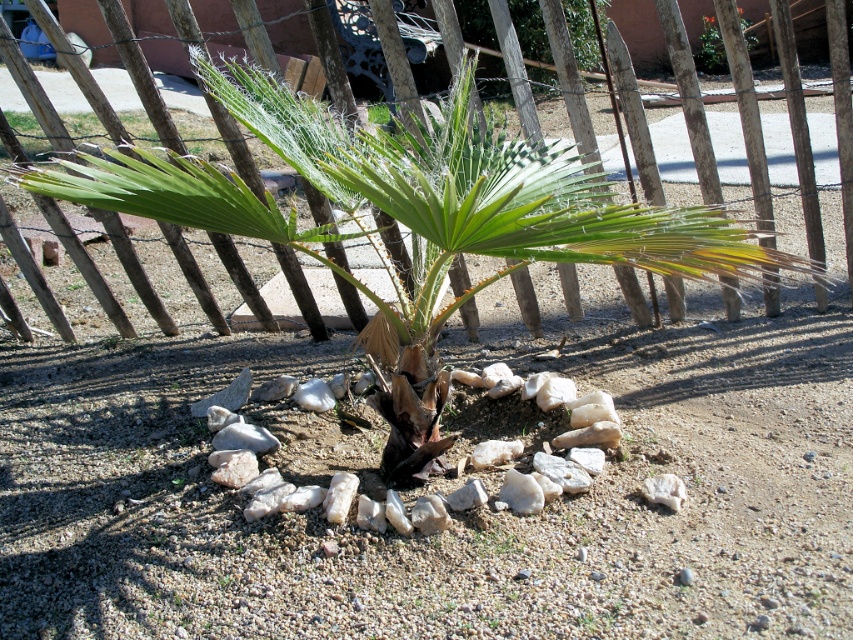
Between point (827, 125) and point (705, 45), which one is positioned behind?

The point (705, 45) is behind.

Between wooden at center and green leafy plant at upper center, which one is positioned lower?

wooden at center is lower down.

Between point (820, 177) and point (718, 65), which one is positioned in front?

Point (820, 177)

This screenshot has height=640, width=853. In order to click on wooden at center in this screenshot , I will do `click(672, 154)`.